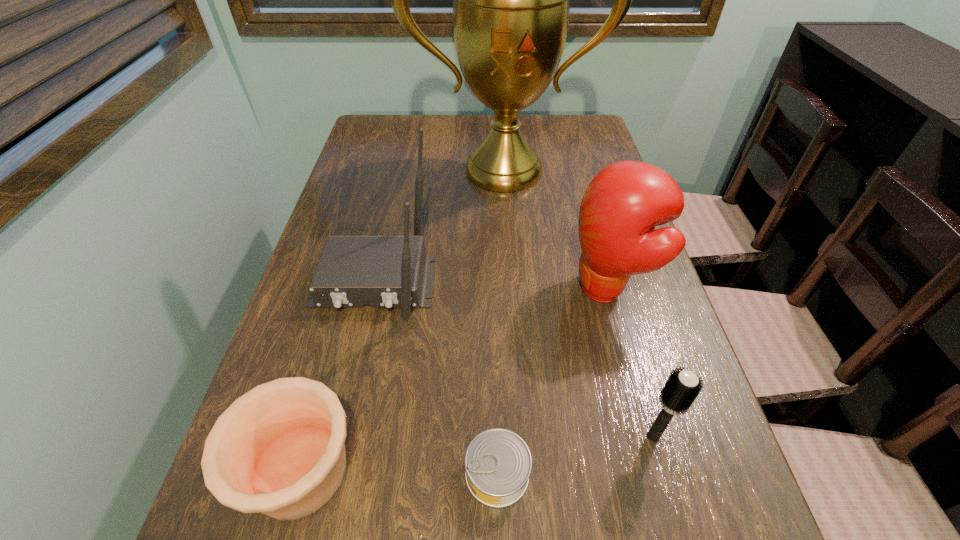
Locate an element on the screen. This screenshot has width=960, height=540. vacant region located on the striking surface of the boxing glove is located at coordinates (454, 289).

I want to click on free space located 0.050m on the striking surface of the boxing glove, so click(543, 289).

The width and height of the screenshot is (960, 540). Find the location of `free spot located on the back of the hairbrush`. free spot located on the back of the hairbrush is located at coordinates (612, 289).

The width and height of the screenshot is (960, 540). Find the location of `vacant space located 0.310m on the back of the second shortest object`. vacant space located 0.310m on the back of the second shortest object is located at coordinates (353, 281).

Identify the location of vacant region located on the left of the shortest object. The width and height of the screenshot is (960, 540). (307, 474).

The image size is (960, 540). I want to click on object present at the far edge, so click(511, 0).

Where is `router that is positioned at the left edge`? This screenshot has height=540, width=960. router that is positioned at the left edge is located at coordinates (381, 271).

At what (x,y) coordinates should I click in order to perform the action: click on pottery that is at the left edge. Please return your answer as a coordinate pair (x, y). This screenshot has height=540, width=960. Looking at the image, I should click on (278, 449).

Identify the location of trophy cup present at the right edge. The image size is (960, 540). (511, 0).

Identify the location of boxing glove that is at the right edge. (622, 205).